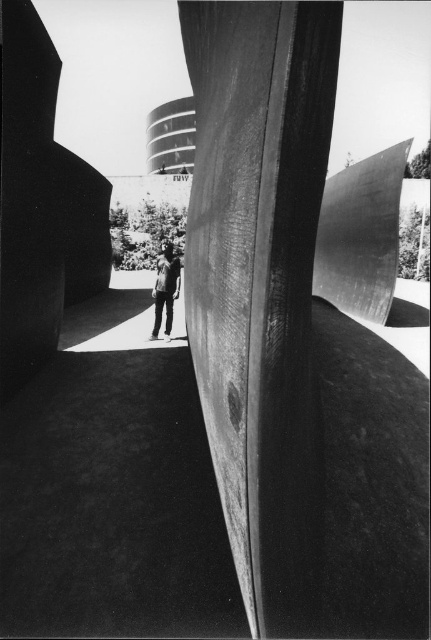
Question: In this image, where is wooden sculpture at center located relative to dark gray jeans at center?

Choices:
 (A) right
 (B) left

Answer: (A)

Question: Does wooden sculpture at center have a lesser width compared to dark gray jeans at center?

Choices:
 (A) yes
 (B) no

Answer: (B)

Question: Does wooden sculpture at center have a lesser width compared to dark gray jeans at center?

Choices:
 (A) yes
 (B) no

Answer: (B)

Question: Which object is closer to the camera taking this photo?

Choices:
 (A) dark gray jeans at center
 (B) wooden sculpture at center

Answer: (B)

Question: Which point is closer to the camera?

Choices:
 (A) (281, 461)
 (B) (165, 333)

Answer: (A)